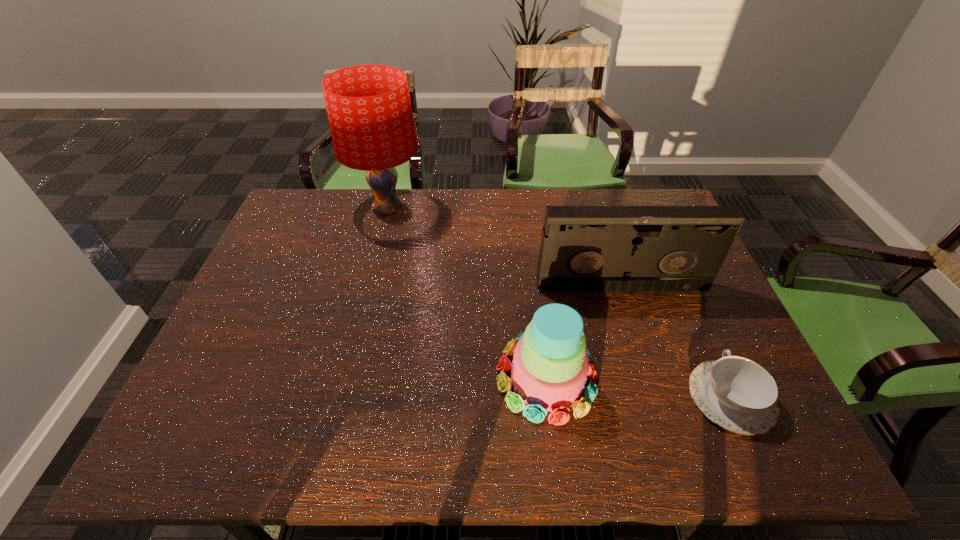
You are a GUI agent. You are given a task and a screenshot of the screen. Output one action in this format:
    pyautogui.click(x=<x>, y=<y>)
    Task: Click on the vacant space at the left edge of the desktop
    This screenshot has width=960, height=540.
    Given the screenshot: What is the action you would take?
    pyautogui.click(x=295, y=256)

At what (x,y) coordinates should I click in order to perform the action: click on free space at the right edge of the desktop. Please return your answer as a coordinate pair (x, y). This screenshot has width=960, height=540. Looking at the image, I should click on (725, 340).

In the image, there is a desktop. Where is `vacant space at the far left corner`? vacant space at the far left corner is located at coordinates (330, 193).

This screenshot has width=960, height=540. In order to click on vacant area at the near left corner in this screenshot , I will do `click(212, 430)`.

This screenshot has height=540, width=960. Find the location of `free point at the near right corner`. free point at the near right corner is located at coordinates (728, 436).

Find the location of `free spot between the leftmost object and the second tallest object`. free spot between the leftmost object and the second tallest object is located at coordinates (504, 247).

This screenshot has width=960, height=540. Identify the location of free space between the third nearest object and the shortest object. point(676,342).

Locate an element on the screen. The image size is (960, 540). unoccupied position between the third nearest object and the leftmost object is located at coordinates (504, 247).

The height and width of the screenshot is (540, 960). What are the coordinates of `free point between the shortest object and the leftmost object` in the screenshot? It's located at (559, 303).

At what (x,y) coordinates should I click in order to perform the action: click on free spot between the chinaware and the third shortest object. Please return your answer as a coordinate pair (x, y). The height and width of the screenshot is (540, 960). Looking at the image, I should click on [676, 342].